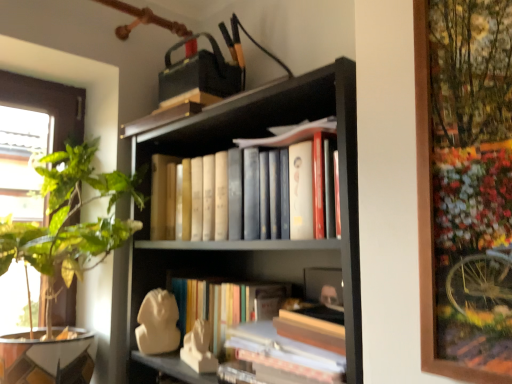
Question: Are green leafy plant at left and hardcover books at center making contact?

Choices:
 (A) no
 (B) yes

Answer: (A)

Question: Is green leafy plant at left oriented away from hardcover books at center?

Choices:
 (A) yes
 (B) no

Answer: (B)

Question: Can you confirm if green leafy plant at left is wider than hardcover books at center?

Choices:
 (A) no
 (B) yes

Answer: (B)

Question: From the image's perspective, is green leafy plant at left above hardcover books at center?

Choices:
 (A) no
 (B) yes

Answer: (A)

Question: From a real-world perspective, does green leafy plant at left stand above hardcover books at center?

Choices:
 (A) yes
 (B) no

Answer: (B)

Question: Can you confirm if green leafy plant at left is thinner than hardcover books at center?

Choices:
 (A) no
 (B) yes

Answer: (A)

Question: Can you confirm if hardcover books at center is thinner than green leafy plant at left?

Choices:
 (A) no
 (B) yes

Answer: (B)

Question: From a real-world perspective, is hardcover books at center located higher than green leafy plant at left?

Choices:
 (A) yes
 (B) no

Answer: (A)

Question: Is hardcover books at center oriented away from green leafy plant at left?

Choices:
 (A) yes
 (B) no

Answer: (B)

Question: Is hardcover books at center completely or partially outside of green leafy plant at left?

Choices:
 (A) no
 (B) yes

Answer: (B)

Question: Is hardcover books at center taller than green leafy plant at left?

Choices:
 (A) no
 (B) yes

Answer: (A)

Question: From a real-world perspective, is hardcover books at center beneath green leafy plant at left?

Choices:
 (A) no
 (B) yes

Answer: (A)

Question: Considering the relative sizes of matte black bookcase at center and hardcover books at center in the image provided, is matte black bookcase at center taller than hardcover books at center?

Choices:
 (A) no
 (B) yes

Answer: (B)